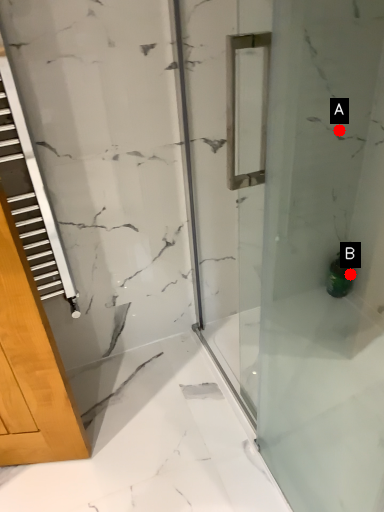
Question: Two points are circled on the image, labeled by A and B beside each circle. Which point is farther to the camera?

Choices:
 (A) A is further
 (B) B is further

Answer: (B)